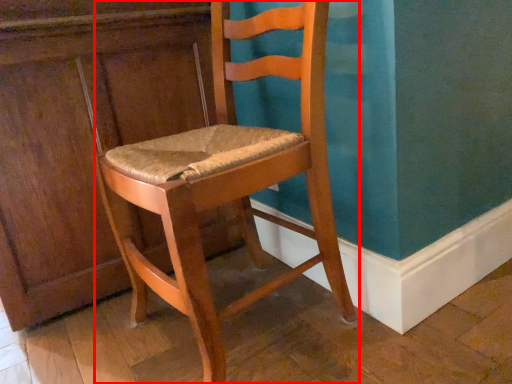
Question: From the image's perspective, considering the relative positions of chair (annotated by the red box) and dresser in the image provided, where is chair (annotated by the red box) located with respect to the staircase?

Choices:
 (A) below
 (B) above

Answer: (A)